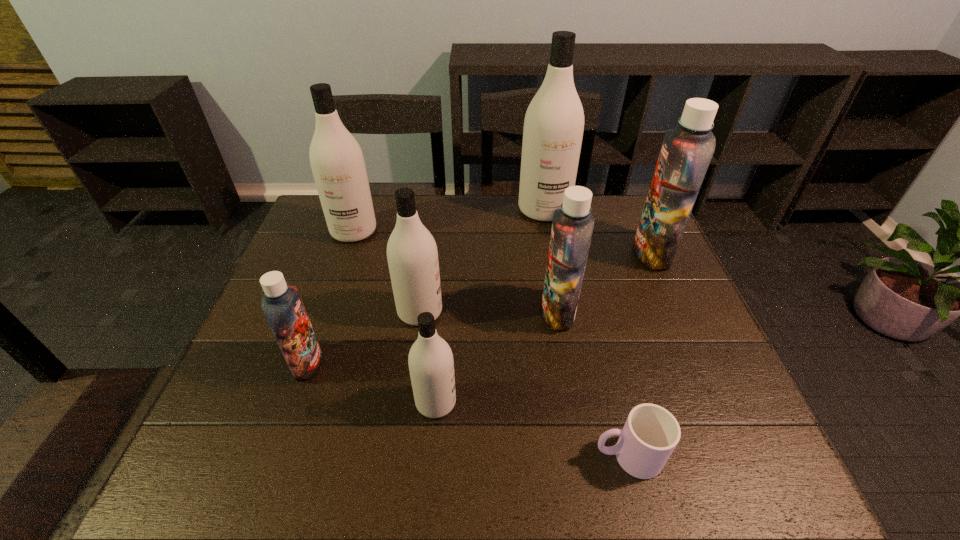
Identify the location of the tallest object. (553, 129).

Find the location of a particular element. the rightmost white shampoo is located at coordinates (553, 129).

The width and height of the screenshot is (960, 540). What are the coordinates of `the rightmost object` in the screenshot? It's located at (686, 152).

Where is `the rightmost blue shampoo`? The height and width of the screenshot is (540, 960). the rightmost blue shampoo is located at coordinates (686, 152).

The width and height of the screenshot is (960, 540). Find the location of `the leftmost white shampoo`. the leftmost white shampoo is located at coordinates (336, 159).

The width and height of the screenshot is (960, 540). I want to click on the second blue shampoo from right to left, so click(572, 227).

Where is `the second smallest blue shampoo`? The width and height of the screenshot is (960, 540). the second smallest blue shampoo is located at coordinates (572, 227).

The image size is (960, 540). Find the location of `the second nearest white shampoo`. the second nearest white shampoo is located at coordinates click(412, 254).

This screenshot has width=960, height=540. Identify the location of the smallest blue shampoo. (282, 306).

Locate an element on the screen. The width and height of the screenshot is (960, 540). the nearest blue shampoo is located at coordinates (282, 306).